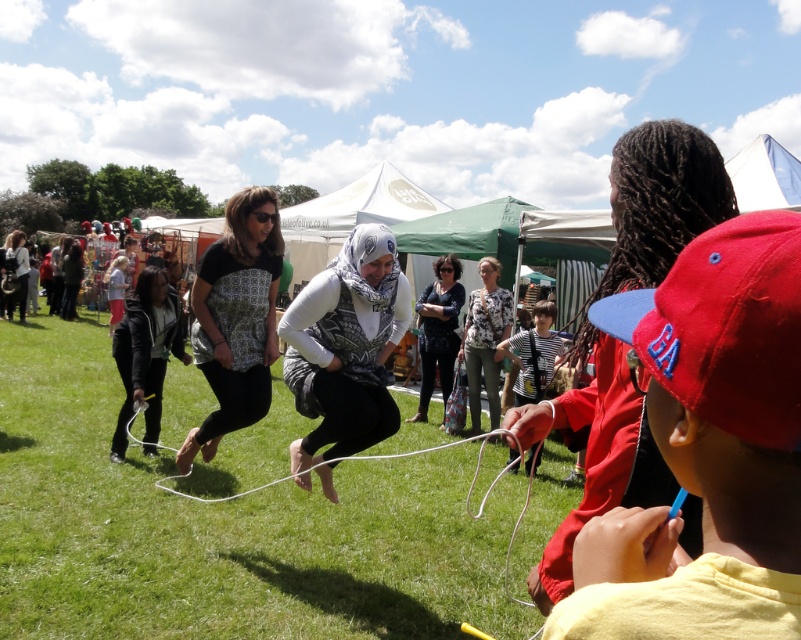
Question: Does dark blue textured blouse at center appear under striped fabric shirt at center?

Choices:
 (A) no
 (B) yes

Answer: (A)

Question: Which object is closer to the camera taking this photo?

Choices:
 (A) dark blue textured blouse at center
 (B) white matte scarf at center
 (C) striped fabric shirt at center

Answer: (B)

Question: Is red cotton cap at right wider than white matte scarf at center?

Choices:
 (A) no
 (B) yes

Answer: (A)

Question: Is floral shirt at center smaller than matte black top at left?

Choices:
 (A) no
 (B) yes

Answer: (B)

Question: Among these objects, which one is farthest from the camera?

Choices:
 (A) black matte jacket at left
 (B) dark blue textured blouse at center
 (C) matte black shirt at center

Answer: (B)

Question: Which point is closer to the camera taking this photo?

Choices:
 (A) (227, 384)
 (B) (38, 481)

Answer: (A)